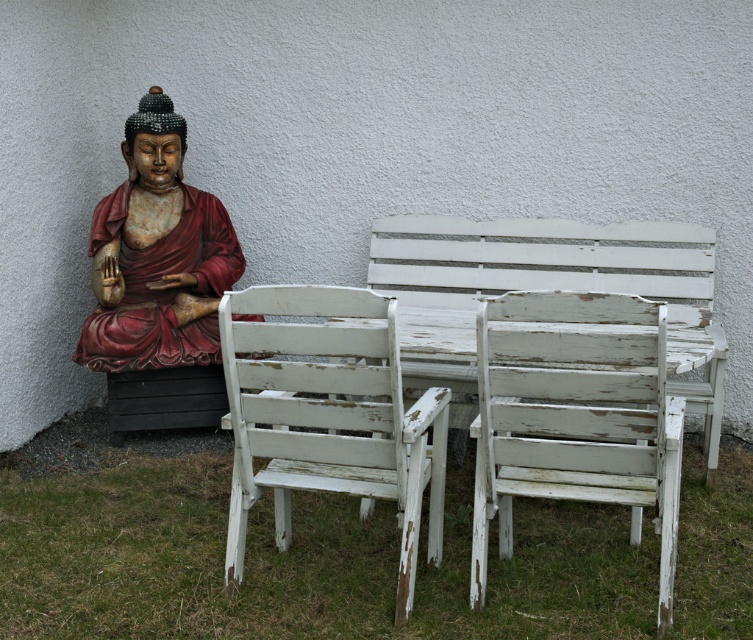
You are a visitor at this serene outdoor area with a Buddha statue. You want to sit between the two chairs to meditate. Can you comfortably sit between the distressed white wood chair at center and the white chipped paint chair at center if you need at least 60 centimeters of space?

The distressed white wood chair at center is 59.44 centimeters from the white chipped paint chair at center, which is slightly less than the required 60 centimeters. Therefore, there might not be enough space for you to comfortably sit between them.

You are a painter who needs to decide which object to paint first. You have a limited amount of paint and want to cover the largest object first. Based on the scene, which object should you choose between the white chipped paint chair at center and the white chipped paint table at center?

The white chipped paint chair at center has a larger size compared to the white chipped paint table at center, so you should paint the white chipped paint chair at center first to use the paint efficiently.

You are standing in front of the Buddha statue and want to place a small offering on the table. To do this, you need to walk around the statue. Which point, point [194,192] or point [456,426], is closer to the statue so you can reach it without going around?

Point [194,192] is behind point [456,426], so the point closer to the statue would be point [456,426]. Therefore, you can reach it without needing to go around the statue.